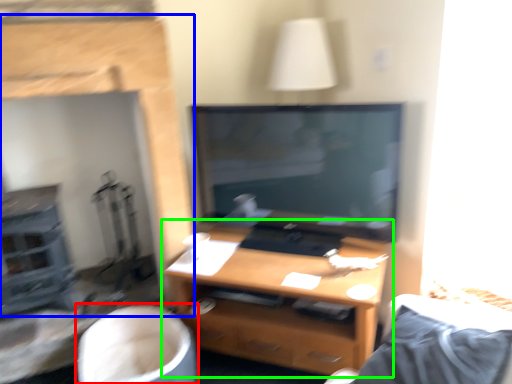
Question: Considering the real-world distances, which object is farthest from swivel chair (highlighted by a red box)? fireplace (highlighted by a blue box) or desk (highlighted by a green box)?

Choices:
 (A) fireplace
 (B) desk

Answer: (A)